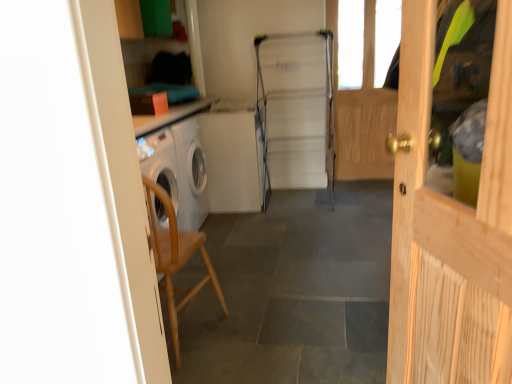
Identify the location of vacant space to the right of wooden chair at left. click(263, 338).